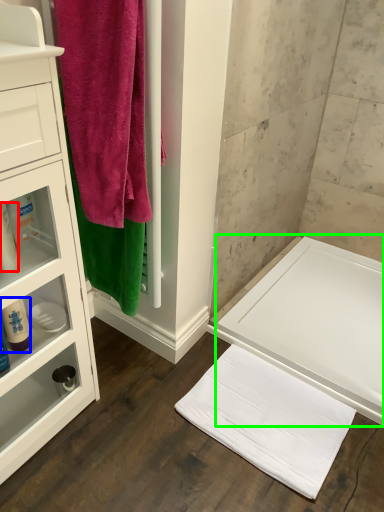
Question: Based on their relative distances, which object is nearer to toiletry (highlighted by a red box)? Choose from cleaning product (highlighted by a blue box) and bath (highlighted by a green box).

Choices:
 (A) cleaning product
 (B) bath

Answer: (A)